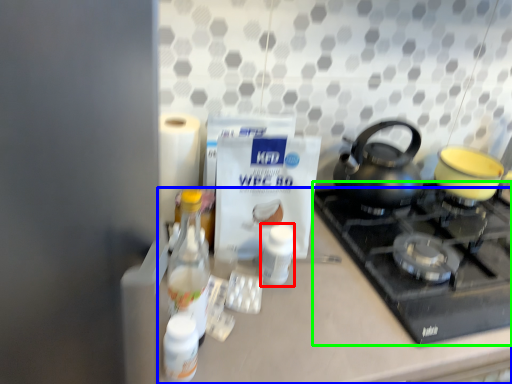
Question: Which is farther away from bottle (highlighted by a red box)? counter (highlighted by a blue box) or gas stove (highlighted by a green box)?

Choices:
 (A) counter
 (B) gas stove

Answer: (B)